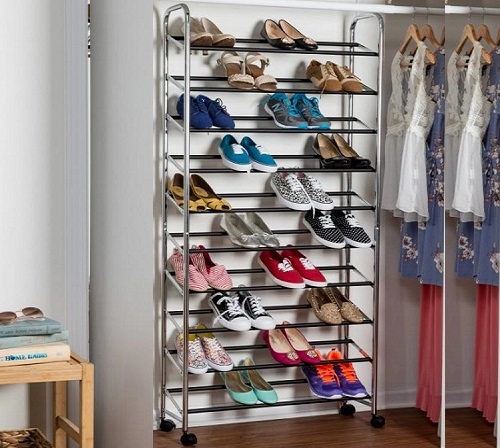
Locate an element on the screen. The width and height of the screenshot is (500, 448). shelves is located at coordinates (345, 51), (373, 93), (369, 129), (314, 171), (359, 205), (310, 248), (356, 285), (312, 326), (358, 360), (305, 399).